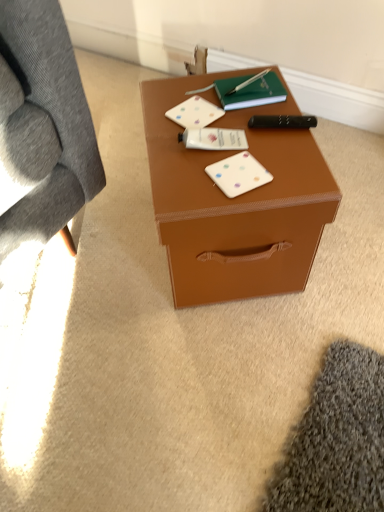
The width and height of the screenshot is (384, 512). I want to click on free space in front of black plastic remote control at right, so [x=284, y=168].